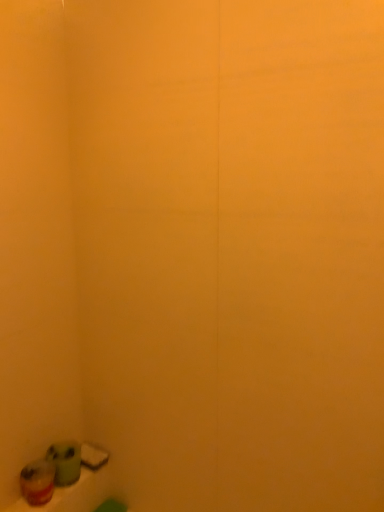
Image resolution: width=384 pixels, height=512 pixels. Describe the element at coordinates (65, 462) in the screenshot. I see `matte green candle at lower left` at that location.

The height and width of the screenshot is (512, 384). What are the coordinates of `matte green candle at lower left` in the screenshot? It's located at (65, 462).

Identify the location of matte green candle at lower left. The height and width of the screenshot is (512, 384). (65, 462).